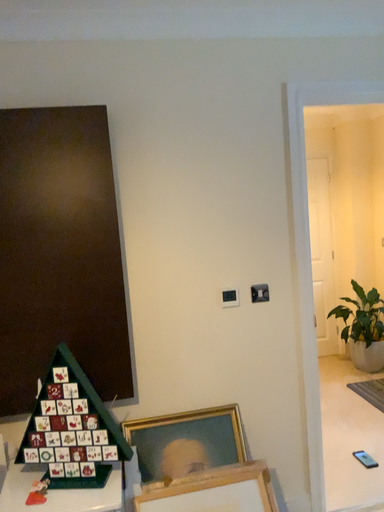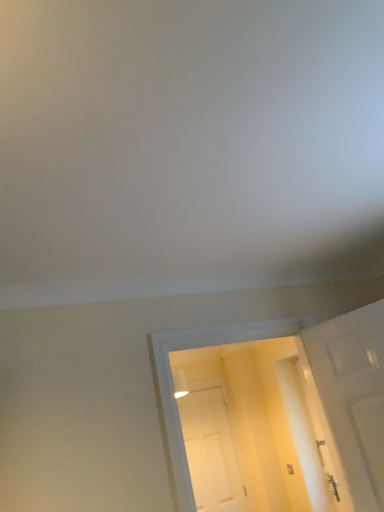
Question: Which way did the camera rotate in the video?

Choices:
 (A) rotated left
 (B) rotated right

Answer: (B)